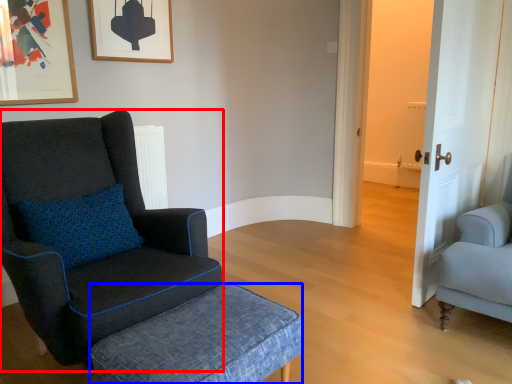
Question: Among these objects, which one is farthest to the camera, chair (highlighted by a red box) or stool (highlighted by a blue box)?

Choices:
 (A) chair
 (B) stool

Answer: (A)